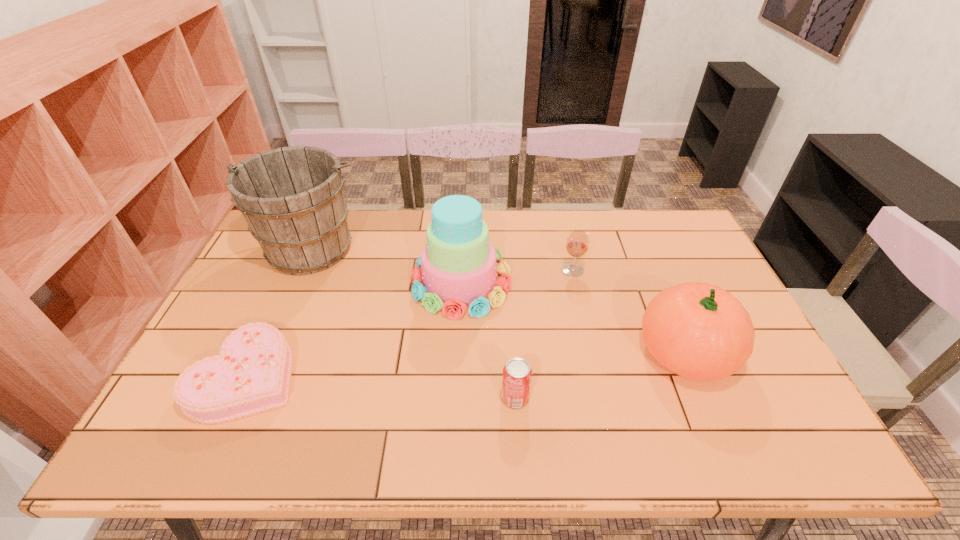
At what (x,y) coordinates should I click in order to perform the action: click on bucket. Please return your answer as a coordinate pair (x, y). Looking at the image, I should click on (292, 198).

Image resolution: width=960 pixels, height=540 pixels. What are the coordinates of `the taller cake` in the screenshot? It's located at (457, 267).

Identify the location of the fifth shortest object. The height and width of the screenshot is (540, 960). (457, 267).

Locate an element on the screen. Image resolution: width=960 pixels, height=540 pixels. the fourth shortest object is located at coordinates (699, 331).

Image resolution: width=960 pixels, height=540 pixels. Find the location of `pumpkin`. pumpkin is located at coordinates (699, 331).

Identify the location of wineglass. (577, 244).

You are a GUI agent. You are given a task and a screenshot of the screen. Output one action in this format:
    pyautogui.click(x=<x>, y=<y>)
    Task: Click on the soda can
    The width and height of the screenshot is (960, 540).
    Given the screenshot: What is the action you would take?
    pyautogui.click(x=517, y=374)

I want to click on the shorter cake, so click(251, 374).

Find the location of a particular element. the shortest object is located at coordinates (251, 374).

At what (x,y) coordinates should I click in order to perform the action: click on vacant region located on the right of the right cake. Please return your answer as a coordinate pair (x, y). This screenshot has height=540, width=960. Looking at the image, I should click on (640, 281).